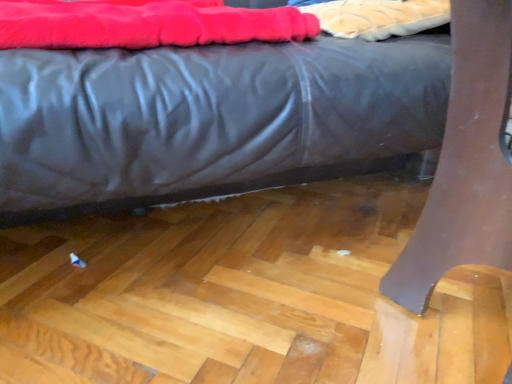
What do you see at coordinates (379, 17) in the screenshot? The height and width of the screenshot is (384, 512). I see `velvet-like fabric at upper center` at bounding box center [379, 17].

The image size is (512, 384). In order to click on velvet-like red blanket at upper left in this screenshot , I will do `click(145, 24)`.

In the scene shown: Measure the distance from matte black bed at center to velvet-like red blanket at upper left.

matte black bed at center is 5.04 inches from velvet-like red blanket at upper left.

From the image's perspective, is matte black bed at center above or below velvet-like red blanket at upper left?

Clearly, from the image's perspective, matte black bed at center is below velvet-like red blanket at upper left.

In terms of size, does matte black bed at center appear bigger or smaller than velvet-like red blanket at upper left?

Considering their sizes, matte black bed at center takes up more space than velvet-like red blanket at upper left.

Can you confirm if matte black bed at center is taller than velvet-like red blanket at upper left?

Indeed, matte black bed at center has a greater height compared to velvet-like red blanket at upper left.

Who is smaller, velvet-like red blanket at upper left or velvet-like fabric at upper center?

With smaller size is velvet-like fabric at upper center.

Can you confirm if velvet-like red blanket at upper left is positioned to the right of velvet-like fabric at upper center?

Incorrect, velvet-like red blanket at upper left is not on the right side of velvet-like fabric at upper center.

Between velvet-like red blanket at upper left and velvet-like fabric at upper center, which one has more height?

velvet-like red blanket at upper left is taller.

Find the location of `blanket on the left of velvet-like fabric at upper center`. blanket on the left of velvet-like fabric at upper center is located at coordinates (145, 24).

Consider the image. Considering the relative sizes of matte black bed at center and velvet-like fabric at upper center in the image provided, is matte black bed at center thinner than velvet-like fabric at upper center?

In fact, matte black bed at center might be wider than velvet-like fabric at upper center.

Is matte black bed at center facing towards velvet-like fabric at upper center?

No, matte black bed at center does not turn towards velvet-like fabric at upper center.

Looking at this image, does matte black bed at center have a greater height compared to velvet-like fabric at upper center?

Yes.

From the image's perspective, is velvet-like fabric at upper center on top of velvet-like red blanket at upper left?

Indeed, from the image's perspective, velvet-like fabric at upper center is shown above velvet-like red blanket at upper left.

Can you confirm if velvet-like fabric at upper center is taller than velvet-like red blanket at upper left?

Incorrect, the height of velvet-like fabric at upper center is not larger of that of velvet-like red blanket at upper left.

Considering the points (417, 26) and (134, 35), which point is in front, point (417, 26) or point (134, 35)?

The point (134, 35) is in front.

The height and width of the screenshot is (384, 512). What are the coordinates of `material located behind the matte black bed at center` in the screenshot? It's located at (379, 17).

Between velvet-like fabric at upper center and matte black bed at center, which one has more height?

matte black bed at center is taller.

Between velvet-like fabric at upper center and matte black bed at center, which one is positioned behind?

velvet-like fabric at upper center is further away from the camera.

Between point (345, 25) and point (90, 79), which one is positioned behind?

The point (345, 25) is behind.

Which is in front, velvet-like red blanket at upper left or matte black bed at center?

matte black bed at center is in front.

Considering the relative sizes of velvet-like red blanket at upper left and matte black bed at center in the image provided, is velvet-like red blanket at upper left thinner than matte black bed at center?

Correct, the width of velvet-like red blanket at upper left is less than that of matte black bed at center.

Considering the positions of objects velvet-like red blanket at upper left and matte black bed at center in the image provided, who is more to the right, velvet-like red blanket at upper left or matte black bed at center?

matte black bed at center is more to the right.

The image size is (512, 384). In the image, there is a velvet-like red blanket at upper left. Identify the location of bed below it (from the image's perspective). (209, 119).

The image size is (512, 384). I want to click on blanket located underneath the velvet-like fabric at upper center (from a real-world perspective), so click(x=145, y=24).

In the scene shown: Based on their spatial positions, is matte black bed at center or velvet-like fabric at upper center further from velvet-like red blanket at upper left?

Among the two, velvet-like fabric at upper center is located further to velvet-like red blanket at upper left.

From the image, which object appears to be nearer to velvet-like fabric at upper center, matte black bed at center or velvet-like red blanket at upper left?

matte black bed at center.

Which object lies further to the anchor point matte black bed at center, velvet-like fabric at upper center or velvet-like red blanket at upper left?

The object further to matte black bed at center is velvet-like fabric at upper center.

Based on their spatial positions, is velvet-like red blanket at upper left or velvet-like fabric at upper center further from matte black bed at center?

velvet-like fabric at upper center.

Based on their spatial positions, is velvet-like fabric at upper center or matte black bed at center further from velvet-like red blanket at upper left?

The object further to velvet-like red blanket at upper left is velvet-like fabric at upper center.

Based on their spatial positions, is velvet-like red blanket at upper left or matte black bed at center closer to velvet-like fabric at upper center?

matte black bed at center lies closer to velvet-like fabric at upper center than the other object.

Find the location of `bed situated between velvet-like red blanket at upper left and velvet-like fabric at upper center from left to right`. bed situated between velvet-like red blanket at upper left and velvet-like fabric at upper center from left to right is located at coordinates (209, 119).